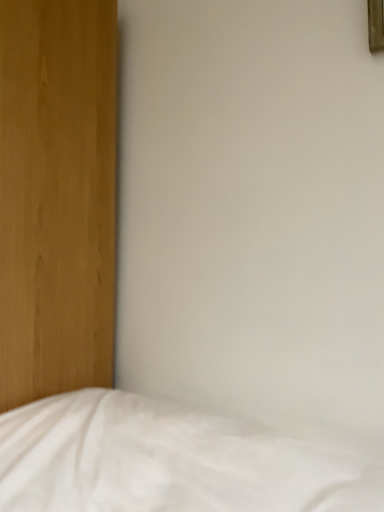
Question: From the image's perspective, is wooden picture frame at upper right over white soft bed at lower left?

Choices:
 (A) yes
 (B) no

Answer: (A)

Question: Is wooden picture frame at upper right positioned beyond the bounds of white soft bed at lower left?

Choices:
 (A) no
 (B) yes

Answer: (B)

Question: Is wooden picture frame at upper right at the right side of white soft bed at lower left?

Choices:
 (A) yes
 (B) no

Answer: (A)

Question: Does wooden picture frame at upper right have a smaller size compared to white soft bed at lower left?

Choices:
 (A) yes
 (B) no

Answer: (A)

Question: Is there a large distance between wooden picture frame at upper right and white soft bed at lower left?

Choices:
 (A) yes
 (B) no

Answer: (A)

Question: Considering the relative sizes of wooden picture frame at upper right and white soft bed at lower left in the image provided, is wooden picture frame at upper right shorter than white soft bed at lower left?

Choices:
 (A) no
 (B) yes

Answer: (B)

Question: Is white soft bed at lower left to the right of wooden picture frame at upper right from the viewer's perspective?

Choices:
 (A) no
 (B) yes

Answer: (A)

Question: Could you tell me if white soft bed at lower left is facing wooden picture frame at upper right?

Choices:
 (A) yes
 (B) no

Answer: (B)

Question: Can you confirm if white soft bed at lower left is wider than wooden picture frame at upper right?

Choices:
 (A) yes
 (B) no

Answer: (A)

Question: From the image's perspective, is white soft bed at lower left located beneath wooden picture frame at upper right?

Choices:
 (A) no
 (B) yes

Answer: (B)

Question: From a real-world perspective, is white soft bed at lower left positioned under wooden picture frame at upper right based on gravity?

Choices:
 (A) no
 (B) yes

Answer: (B)

Question: Does white soft bed at lower left have a lesser width compared to wooden picture frame at upper right?

Choices:
 (A) no
 (B) yes

Answer: (A)

Question: From a real-world perspective, is white soft bed at lower left physically located above or below wooden picture frame at upper right?

Choices:
 (A) above
 (B) below

Answer: (B)